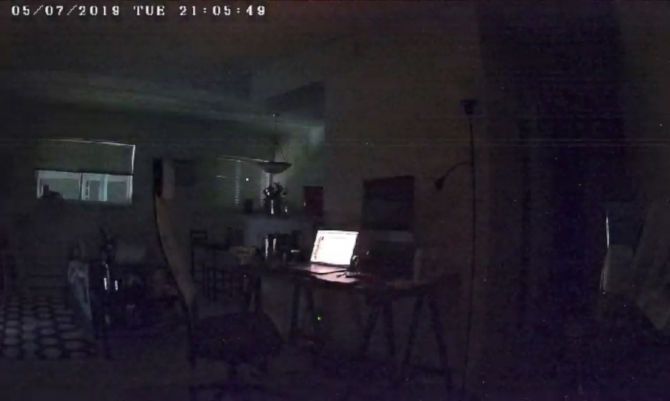
Where is `shades`? This screenshot has width=670, height=401. shades is located at coordinates 226,182, 245,173.